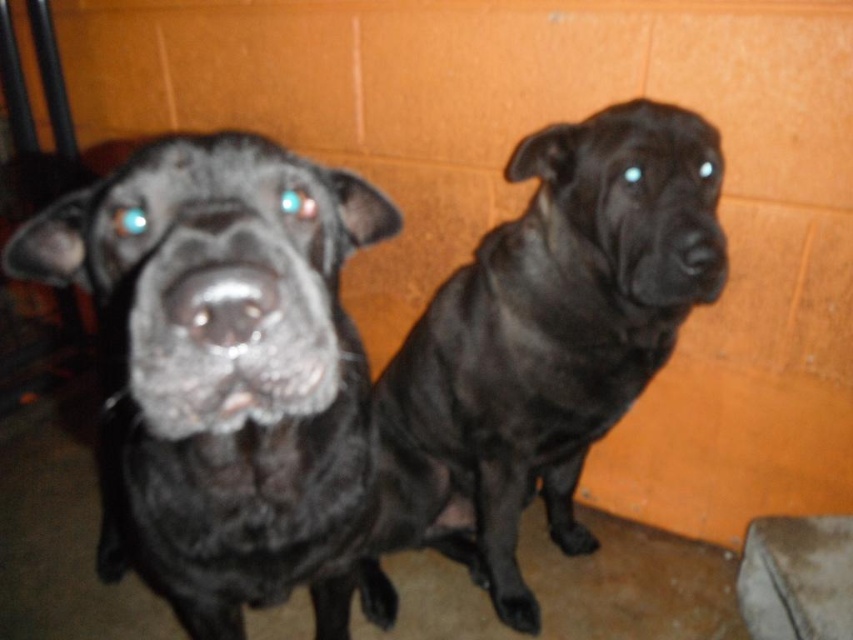
You are taking a photo of two dogs in a room with an orange wall. You want to focus your camera on the point closer to you between point (252, 410) and point (564, 209). Which point should you choose?

You should choose point (252, 410) because it is closer to the camera than point (564, 209).

You are a photographer setting up a shoot in a basement with an orange wall. You need to position two subjects, the shiny black dog at left and the shiny black dog at center, such that their reflections in the camera flash are visible. Given their current positions, which dog is positioned lower relative to the other?

The shiny black dog at left is positioned lower than the shiny black dog at center, so its reflection would appear lower in the camera frame.

You are standing in the room and want to take a photo of the shiny black dog at left. Where should you position yourself to capture it in the center of your camera viewfinder?

To center the shiny black dog at left in your camera viewfinder, position yourself directly in front of it at its 2D location coordinates point (224, 371).